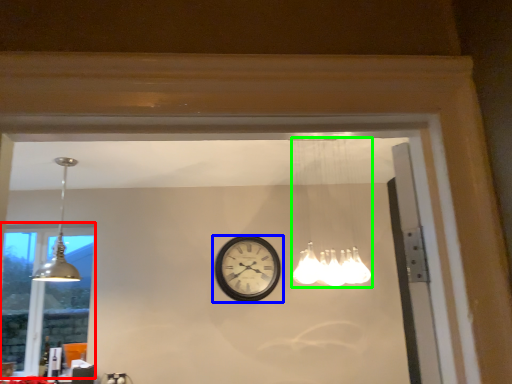
Question: Which is farther away from window (highlighted by a red box)? wall clock (highlighted by a blue box) or lamp (highlighted by a green box)?

Choices:
 (A) wall clock
 (B) lamp

Answer: (B)